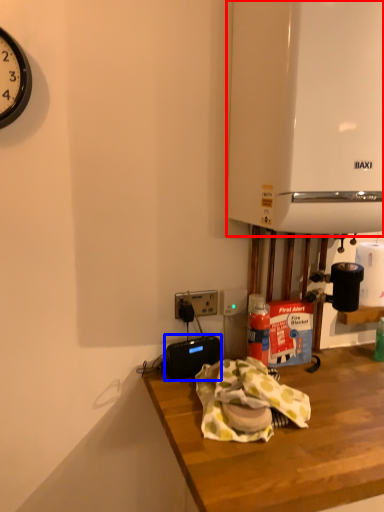
Question: Which point is further to the camera, appliance (highlighted by a red box) or appliance (highlighted by a blue box)?

Choices:
 (A) appliance
 (B) appliance

Answer: (B)